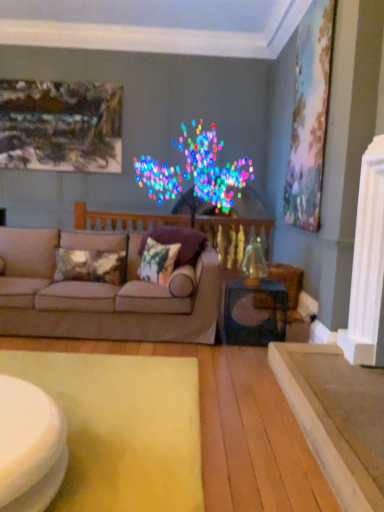
Question: From the image's perspective, does wooden balustrade at center appear lower than pastel canvas painting at upper right, positioned as the first picture frame in front-to-back order?

Choices:
 (A) no
 (B) yes

Answer: (B)

Question: Could pastel canvas painting at upper right, the 2th picture frame when ordered from left to right, be considered to be inside wooden balustrade at center?

Choices:
 (A) no
 (B) yes

Answer: (A)

Question: Is pastel canvas painting at upper right, the 2th picture frame when ordered from left to right, at the back of wooden balustrade at center?

Choices:
 (A) yes
 (B) no

Answer: (B)

Question: Does wooden balustrade at center have a lesser width compared to pastel canvas painting at upper right, the 1th picture frame positioned from the right?

Choices:
 (A) yes
 (B) no

Answer: (B)

Question: Is wooden balustrade at center not near pastel canvas painting at upper right, positioned as the second picture frame in back-to-front order?

Choices:
 (A) no
 (B) yes

Answer: (B)

Question: Considering the positions of yellow felt mat at lower left and matte black side table at lower right in the image, is yellow felt mat at lower left wider or thinner than matte black side table at lower right?

Choices:
 (A) thin
 (B) wide

Answer: (B)

Question: Is yellow felt mat at lower left to the left or to the right of matte black side table at lower right in the image?

Choices:
 (A) right
 (B) left

Answer: (B)

Question: Is yellow felt mat at lower left bigger or smaller than matte black side table at lower right?

Choices:
 (A) small
 (B) big

Answer: (B)

Question: Is yellow felt mat at lower left situated inside matte black side table at lower right or outside?

Choices:
 (A) outside
 (B) inside

Answer: (A)

Question: Is point (66, 254) positioned closer to the camera than point (228, 343)?

Choices:
 (A) farther
 (B) closer

Answer: (A)

Question: From a real-world perspective, is metallic sheen pillow at center, which is the third pillow from right to left, above or below matte black side table at lower right?

Choices:
 (A) above
 (B) below

Answer: (A)

Question: Considering the relative positions of metallic sheen pillow at center, marked as the first pillow in a left-to-right arrangement, and matte black side table at lower right in the image provided, is metallic sheen pillow at center, marked as the first pillow in a left-to-right arrangement, to the left or to the right of matte black side table at lower right?

Choices:
 (A) right
 (B) left

Answer: (B)

Question: Based on their sizes in the image, would you say metallic sheen pillow at center, marked as the first pillow in a left-to-right arrangement, is bigger or smaller than matte black side table at lower right?

Choices:
 (A) big
 (B) small

Answer: (B)

Question: Would you say smooth white table at lower left is to the left or to the right of metallic silver picture frame at upper left, which ranks as the 2th picture frame in right-to-left order, in the picture?

Choices:
 (A) left
 (B) right

Answer: (B)

Question: Does point (23, 446) appear closer or farther from the camera than point (41, 96)?

Choices:
 (A) farther
 (B) closer

Answer: (B)